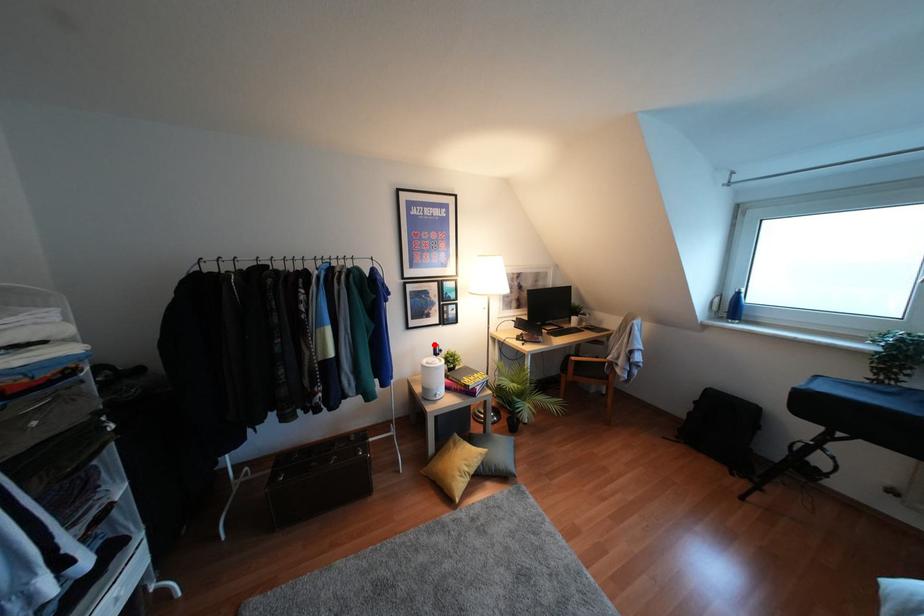
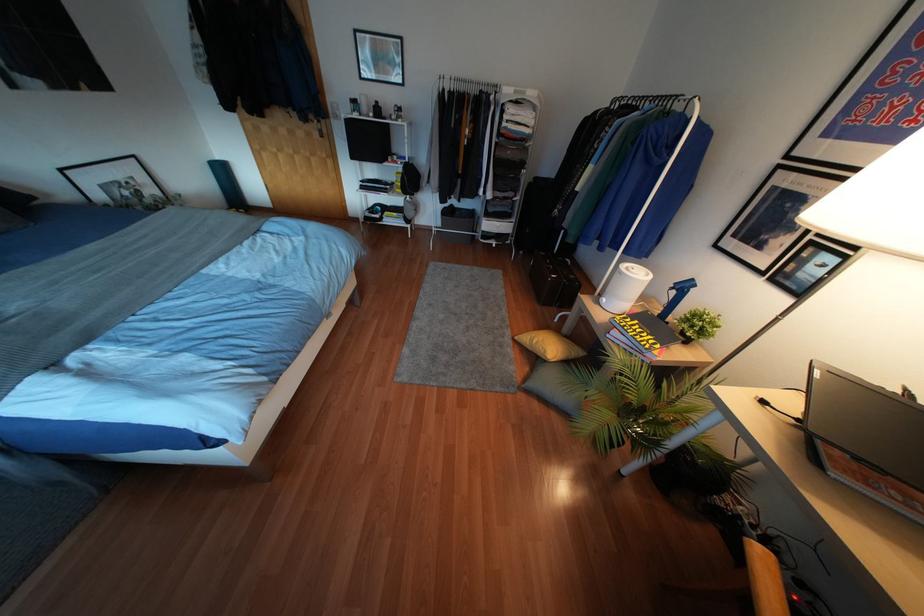
Question: I am providing you with two images of the same scene from different viewpoints. A red point is shown in image1. For the corresponding object point in image2, is it positioned nearer or farther from the camera?

Choices:
 (A) Nearer
 (B) Farther

Answer: (A)